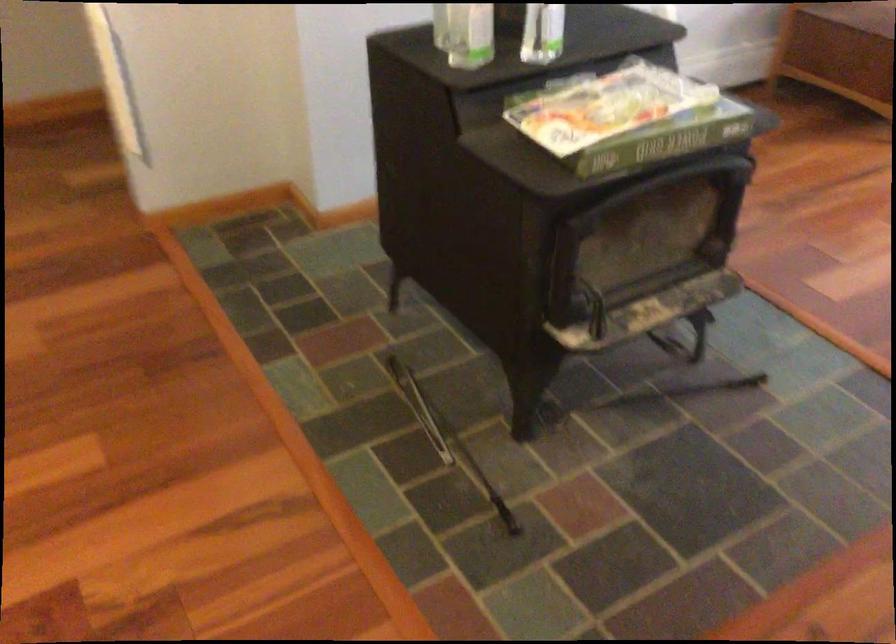
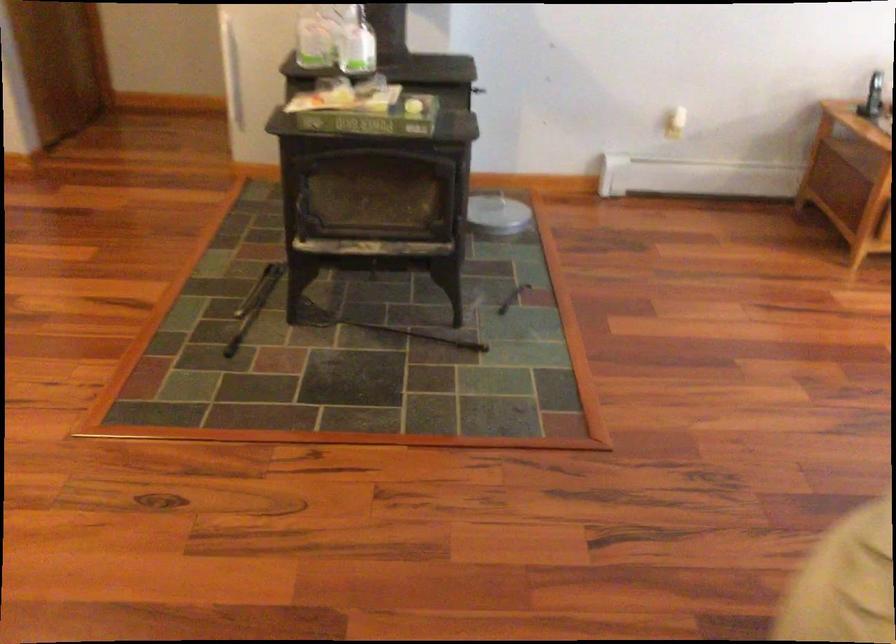
The point at (624, 399) is marked in the first image. Where is the corresponding point in the second image?

(380, 327)